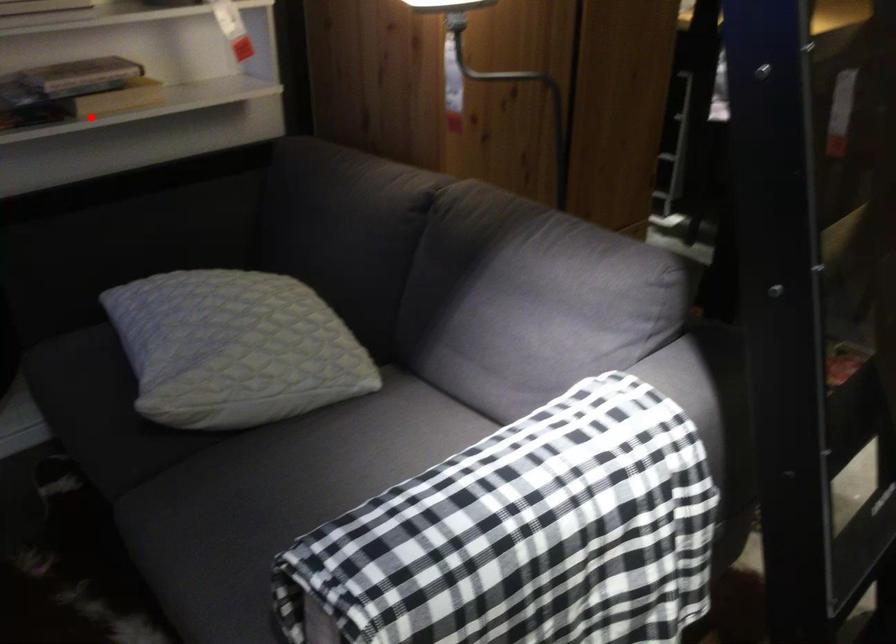
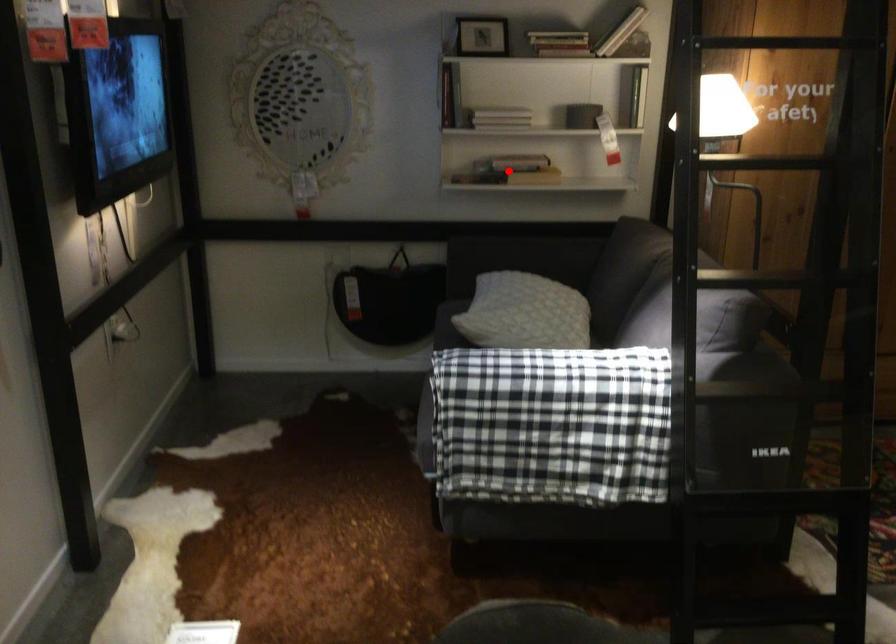
I am providing you with two images of the same scene from different viewpoints. A red point is marked on the first image and another point is marked on the second image. Is the marked point in image1 the same physical position as the marked point in image2?

Yes